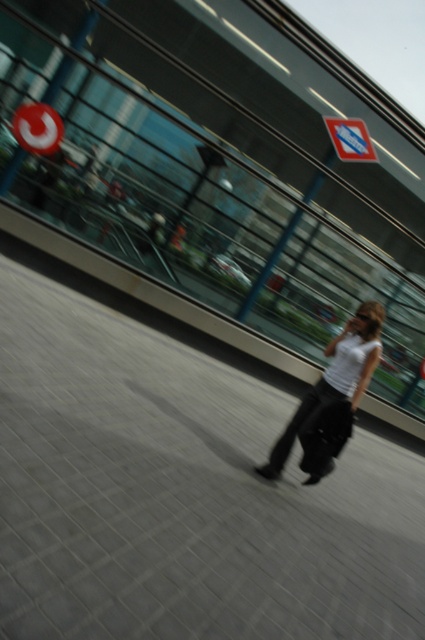
Locate an element on the screen. The width and height of the screenshot is (425, 640). white matte shirt at center is located at coordinates coord(362,340).

Can you confirm if white matte shirt at center is positioned to the right of blue reflective sign at upper center?

In fact, white matte shirt at center is to the left of blue reflective sign at upper center.

Does point (311, 481) lie behind point (345, 145)?

No, it is not.

This screenshot has width=425, height=640. Find the location of `white matte shirt at center`. white matte shirt at center is located at coordinates (362, 340).

Does point (289, 460) come farther from viewer compared to point (348, 118)?

No.

Based on the photo, does gray concrete pavement at center appear on the left side of blue reflective sign at upper center?

Correct, you'll find gray concrete pavement at center to the left of blue reflective sign at upper center.

Does point (19, 307) come in front of point (362, 141)?

Yes, it is in front of point (362, 141).

This screenshot has height=640, width=425. I want to click on gray concrete pavement at center, so click(181, 493).

Which is below, gray concrete pavement at center or matte red circle at upper left?

Positioned lower is gray concrete pavement at center.

Which is in front, point (155, 492) or point (31, 122)?

Point (155, 492) is more forward.

Locate an element on the screen. The image size is (425, 640). gray concrete pavement at center is located at coordinates (181, 493).